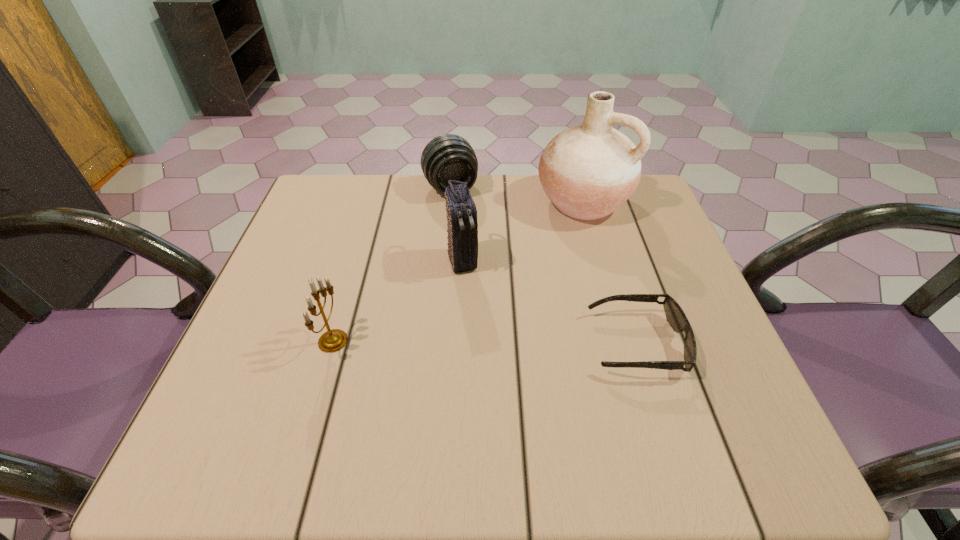
At what (x,y) coordinates should I click in order to perform the action: click on free space on the desktop that is between the leftmost object and the sunglasses and is positioned to pour from the handle of the tallest object. Please return your answer as a coordinate pair (x, y). Looking at the image, I should click on (459, 342).

Where is `free space on the desktop that is between the candelabrum and the shortest object and is positioned at the front element of the telephoto lens`? Image resolution: width=960 pixels, height=540 pixels. free space on the desktop that is between the candelabrum and the shortest object and is positioned at the front element of the telephoto lens is located at coordinates (521, 342).

This screenshot has height=540, width=960. Find the location of `vacant spot on the desktop that is between the leftmost object and the sunglasses and is positioned with the zip open on the third nearest object`. vacant spot on the desktop that is between the leftmost object and the sunglasses and is positioned with the zip open on the third nearest object is located at coordinates (488, 342).